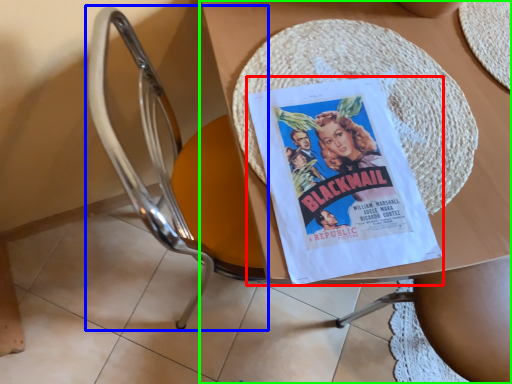
Question: Considering the real-world distances, which object is closest to comic book (highlighted by a red box)? chair (highlighted by a blue box) or table (highlighted by a green box).

Choices:
 (A) chair
 (B) table

Answer: (B)